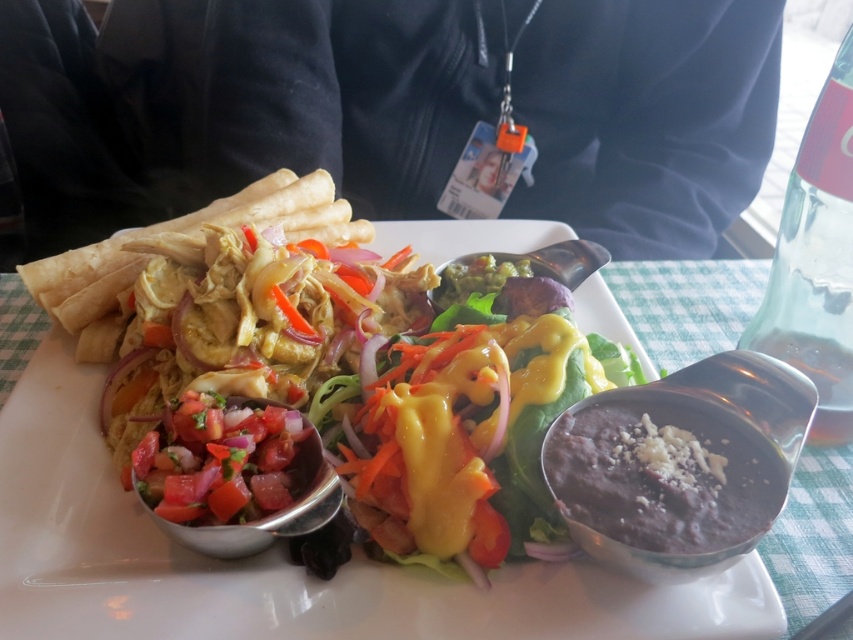
Can you confirm if fresh green salad at center is wider than sliced tomato salad at center?

Correct, the width of fresh green salad at center exceeds that of sliced tomato salad at center.

Who is positioned more to the right, fresh green salad at center or sliced tomato salad at center?

From the viewer's perspective, fresh green salad at center appears more on the right side.

Between point (546, 497) and point (251, 493), which one is positioned in front?

Positioned in front is point (251, 493).

Identify the location of fresh green salad at center. (473, 417).